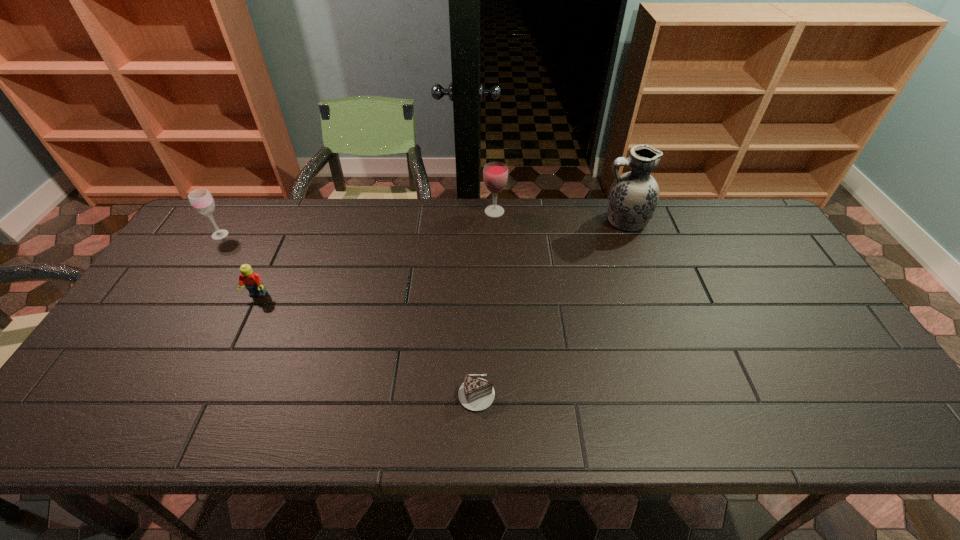
You are a GUI agent. You are given a task and a screenshot of the screen. Output one action in this format:
    pyautogui.click(x=<x>, y=<y>)
    Task: Click on the vase
    
    Given the screenshot: What is the action you would take?
    pyautogui.click(x=633, y=197)

Locate an element on the screen. The image size is (960, 540). the rightmost object is located at coordinates click(x=633, y=197).

Where is `the farther wineglass`? Image resolution: width=960 pixels, height=540 pixels. the farther wineglass is located at coordinates (495, 174).

You are a GUI agent. You are given a task and a screenshot of the screen. Output one action in this format:
    pyautogui.click(x=<x>, y=<y>)
    Task: Click on the left wineglass
    
    Given the screenshot: What is the action you would take?
    pyautogui.click(x=201, y=200)

Find the location of a particular element. The image size is (960, 540). the nearer wineglass is located at coordinates (201, 200).

Locate an element on the screen. the second nearest object is located at coordinates (252, 281).

You are a GUI agent. You are given a task and a screenshot of the screen. Output one action in this format:
    pyautogui.click(x=<x>, y=<y>)
    Task: Click on the second object from left to right
    Image resolution: width=960 pixels, height=540 pixels.
    Given the screenshot: What is the action you would take?
    pyautogui.click(x=252, y=281)

Where is `the shortest object`? This screenshot has height=540, width=960. the shortest object is located at coordinates (476, 394).

Find the location of a particular element. Image resolution: width=960 pixels, height=540 pixels. the nearest object is located at coordinates (476, 394).

This screenshot has height=540, width=960. In order to click on vacant region located with the handle on the side of the rightmost object in this screenshot , I will do (x=491, y=221).